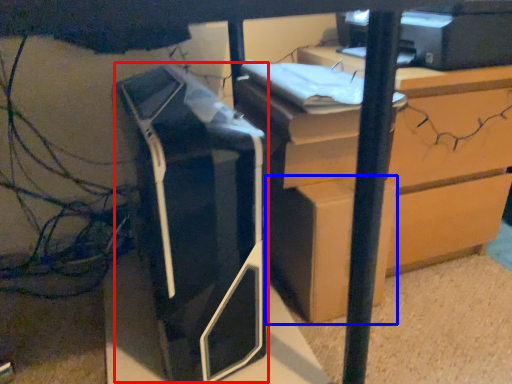
Question: Among these objects, which one is farthest to the camera, printer (highlighted by a red box) or cardboard box (highlighted by a blue box)?

Choices:
 (A) printer
 (B) cardboard box

Answer: (B)